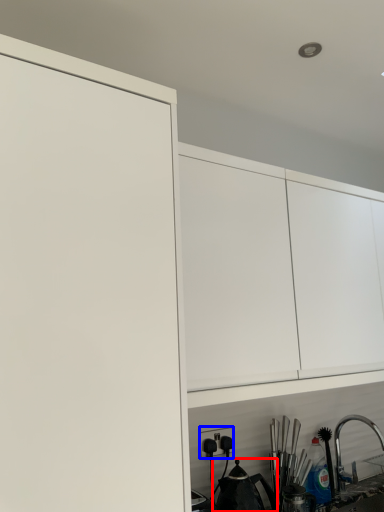
Question: Which of the following is the farthest to the observer, tea pot (highlighted by a red box) or electric outlet (highlighted by a blue box)?

Choices:
 (A) tea pot
 (B) electric outlet

Answer: (B)